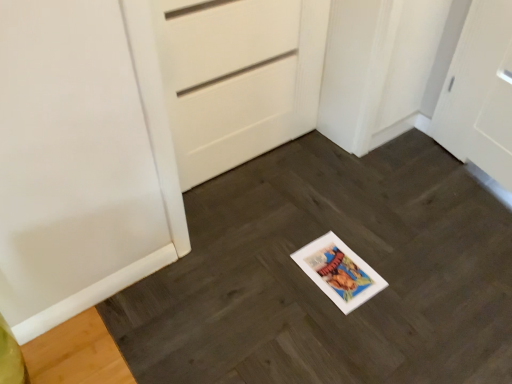
What do you see at coordinates (240, 78) in the screenshot? The width and height of the screenshot is (512, 384). I see `white matte door at center` at bounding box center [240, 78].

Identify the location of white matte door at center. The width and height of the screenshot is (512, 384). (240, 78).

Image resolution: width=512 pixels, height=384 pixels. What are the coordinates of `white paper at center` in the screenshot? It's located at (317, 287).

This screenshot has height=384, width=512. What do you see at coordinates (317, 287) in the screenshot? I see `white paper at center` at bounding box center [317, 287].

Find the location of a particular element. white matte door at center is located at coordinates [x=240, y=78].

Between white paper at center and white matte door at center, which one appears on the right side from the viewer's perspective?

From the viewer's perspective, white paper at center appears more on the right side.

Does white paper at center come behind white matte door at center?

No.

Does point (315, 286) appear closer or farther from the camera than point (196, 27)?

Point (315, 286) appears to be farther away from the viewer than point (196, 27).

From the image's perspective, between white paper at center and white matte door at center, who is located below?

white paper at center, from the image's perspective.

From a real-world perspective, which object rests below the other?

In real-world perspective, white paper at center is lower.

Does white paper at center have a lesser width compared to white matte door at center?

Incorrect, the width of white paper at center is not less than that of white matte door at center.

From their relative heights in the image, would you say white paper at center is taller or shorter than white matte door at center?

Considering their sizes, white paper at center has less height than white matte door at center.

Who is smaller, white paper at center or white matte door at center?

Smaller between the two is white matte door at center.

Would you say white paper at center is outside white matte door at center?

Absolutely, white paper at center is external to white matte door at center.

From the picture: Would you say white paper at center is a long distance from white matte door at center?

That's not correct — white paper at center is a little close to white matte door at center.

Could you tell me if white paper at center is turned towards white matte door at center?

No, white paper at center is not oriented towards white matte door at center.

Identify the location of slate that appears below the white matte door at center (from the image's perspective). (317, 287).

Considering the relative positions of white matte door at center and white paper at center in the image provided, is white matte door at center to the left of white paper at center from the viewer's perspective?

Correct, you'll find white matte door at center to the left of white paper at center.

Between white matte door at center and white paper at center, which one is positioned in front?

white paper at center is more forward.

Is point (204, 47) closer to camera compared to point (352, 372)?

That is False.

From the image's perspective, does white matte door at center appear lower than white paper at center?

Actually, white matte door at center appears above white paper at center in the image.

From a real-world perspective, is white matte door at center physically located above or below white paper at center?

From a real-world perspective, white matte door at center is physically above white paper at center.

Between white matte door at center and white paper at center, which one has smaller width?

With smaller width is white matte door at center.

Who is taller, white matte door at center or white paper at center?

Standing taller between the two is white matte door at center.

Between white matte door at center and white paper at center, which one has larger size?

With larger size is white paper at center.

Consider the image. Is white matte door at center spatially inside white paper at center, or outside of it?

white matte door at center is located beyond the bounds of white paper at center.

Are white matte door at center and white paper at center located far from each other?

That's not correct — white matte door at center is a little close to white paper at center.

Is white paper at center at the back of white matte door at center?

white matte door at center does not have its back to white paper at center.

What's the angular difference between white matte door at center and white paper at center's facing directions?

The angle between the facing direction of white matte door at center and the facing direction of white paper at center is 90.1 degrees.

Where is `slate in front of the white matte door at center`? slate in front of the white matte door at center is located at coordinates (317, 287).

Image resolution: width=512 pixels, height=384 pixels. In order to click on door on the left of white paper at center in this screenshot , I will do `click(240, 78)`.

You are a GUI agent. You are given a task and a screenshot of the screen. Output one action in this format:
    pyautogui.click(x=<x>, y=<y>)
    Task: Click on the slate below the white matte door at center (from the image's perspective)
    The width and height of the screenshot is (512, 384).
    Given the screenshot: What is the action you would take?
    pyautogui.click(x=317, y=287)